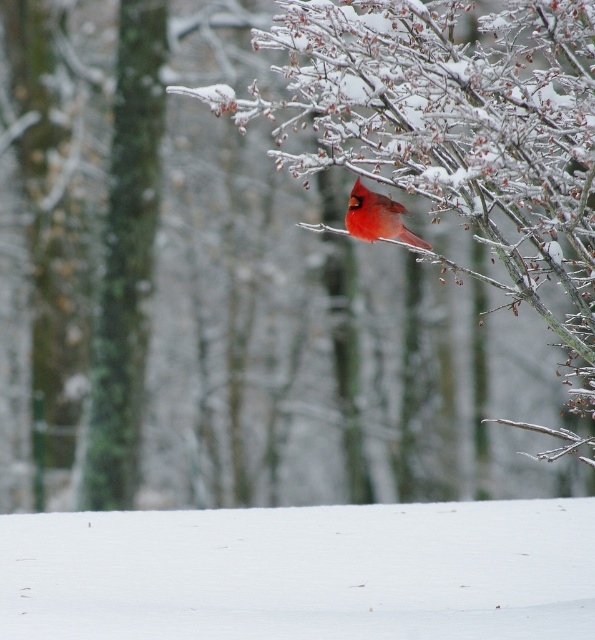
You are a photographer trying to capture the cardinal in the winter scene. You notice two points marked in the image. The first point is at coordinate point [148,568] and the second is at point [352,193]. Which point is closer to the foreground trees that are out of focus?

Point [352,193] is closer to the foreground trees that are out of focus because it is in front of point [148,568], which is behind it.

Based on the photo, you are an ornithologist observing the winter scene. You notice the green mossy tree trunk at left and the matte red cardinal at upper center. Which object is positioned higher in the image?

The green mossy tree trunk at left is located above the matte red cardinal at upper center, so it is positioned higher in the image.

You are standing in the winter scene and want to reach the two points marked in the image. Which point, point (159, 100) or point (384, 209), is closer to you?

Point (159, 100) is closer to you because it is further to the viewer than point (384, 209).